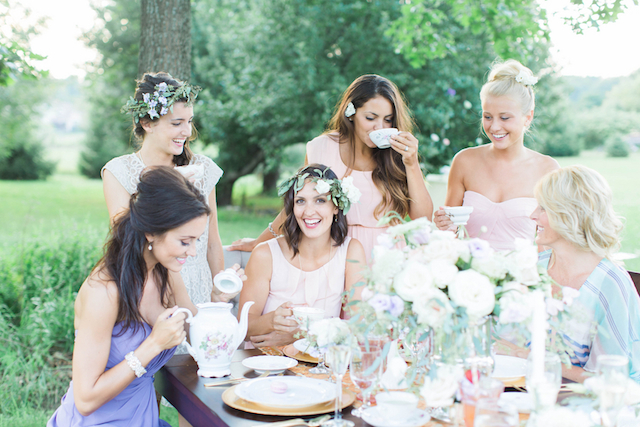
Find the location of a particular element. teapot is located at coordinates (216, 333).